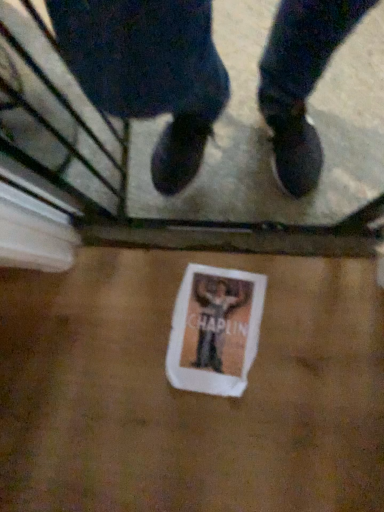
Question: From the image's perspective, is matte black shoes at center positioned above or below white paper flyer at center?

Choices:
 (A) below
 (B) above

Answer: (B)

Question: Considering the positions of point (62, 37) and point (206, 328), is point (62, 37) closer or farther from the camera than point (206, 328)?

Choices:
 (A) farther
 (B) closer

Answer: (B)

Question: Considering the positions of matte black shoes at center and white paper flyer at center in the image, is matte black shoes at center wider or thinner than white paper flyer at center?

Choices:
 (A) wide
 (B) thin

Answer: (B)

Question: Considering the positions of white paper flyer at center and matte black shoes at center in the image, is white paper flyer at center taller or shorter than matte black shoes at center?

Choices:
 (A) tall
 (B) short

Answer: (B)

Question: From the image's perspective, relative to matte black shoes at center, is white paper flyer at center above or below?

Choices:
 (A) below
 (B) above

Answer: (A)

Question: Considering the positions of white paper flyer at center and matte black shoes at center in the image, is white paper flyer at center bigger or smaller than matte black shoes at center?

Choices:
 (A) big
 (B) small

Answer: (B)

Question: Is white paper flyer at center in front of or behind matte black shoes at center in the image?

Choices:
 (A) behind
 (B) front

Answer: (A)